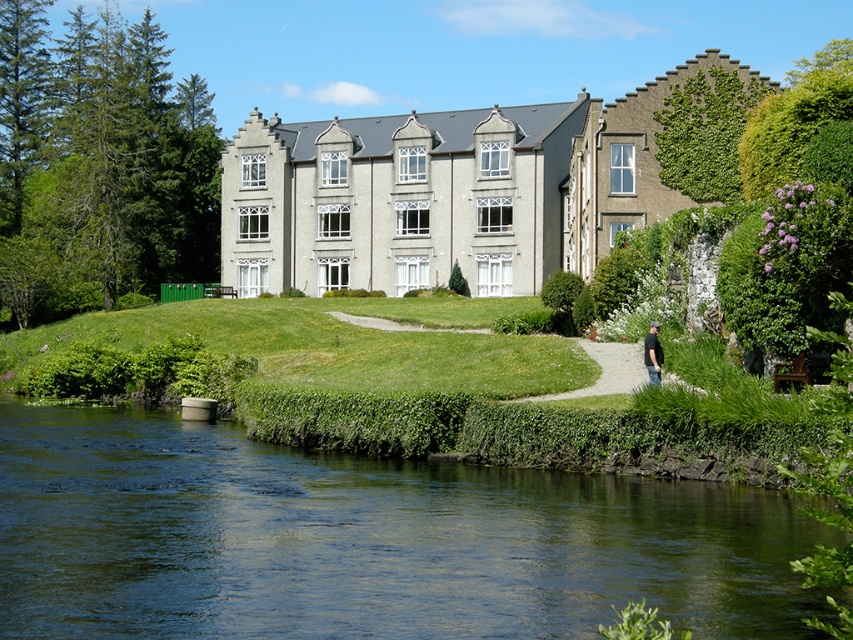
Is green smooth water at lower center shorter than black cotton shirt at lower right?

No.

Does point (148, 413) come in front of point (646, 337)?

No, (148, 413) is behind (646, 337).

Between point (676, 486) and point (654, 348), which one is positioned behind?

The point (654, 348) is more distant.

Locate an element on the screen. Image resolution: width=853 pixels, height=640 pixels. green smooth water at lower center is located at coordinates (364, 540).